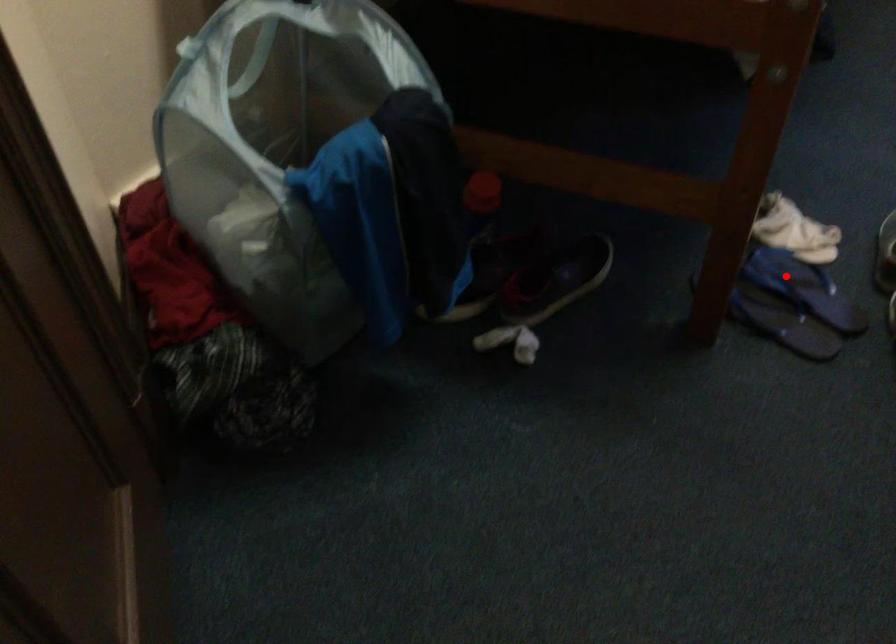
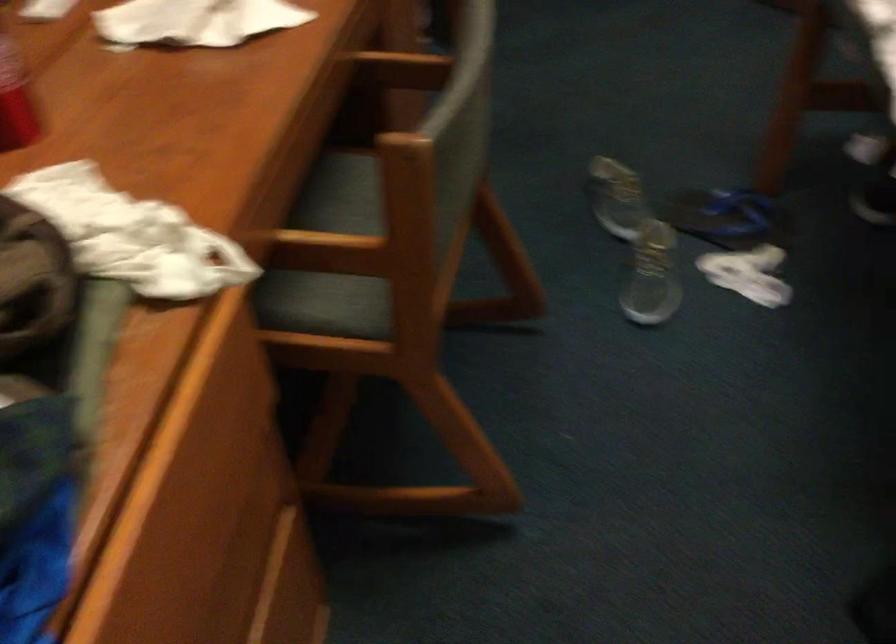
Question: I am providing you with two images of the same scene from different viewpoints. A red point is shown in image1. For the corresponding object point in image2, is it positioned nearer or farther from the camera?

Choices:
 (A) Nearer
 (B) Farther

Answer: (B)